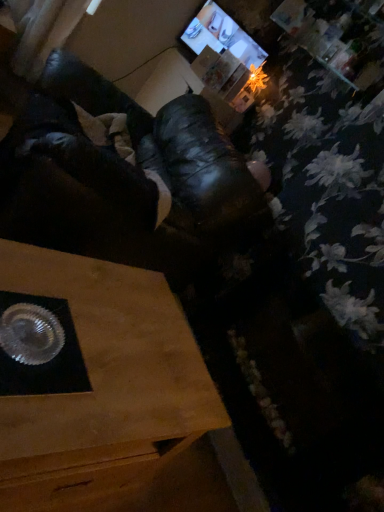
Question: Does wooden table at lower left lie in front of matte black monitor at upper center?

Choices:
 (A) no
 (B) yes

Answer: (B)

Question: Is wooden table at lower left completely or partially outside of matte black monitor at upper center?

Choices:
 (A) no
 (B) yes

Answer: (B)

Question: From a real-world perspective, is wooden table at lower left positioned under matte black monitor at upper center based on gravity?

Choices:
 (A) no
 (B) yes

Answer: (B)

Question: Is wooden table at lower left wider than matte black monitor at upper center?

Choices:
 (A) yes
 (B) no

Answer: (A)

Question: Does wooden table at lower left have a lesser width compared to matte black monitor at upper center?

Choices:
 (A) no
 (B) yes

Answer: (A)

Question: Is matte black monitor at upper center taller or shorter than shiny metallic tray at lower left?

Choices:
 (A) tall
 (B) short

Answer: (B)

Question: Visually, is matte black monitor at upper center positioned to the left or to the right of shiny metallic tray at lower left?

Choices:
 (A) right
 (B) left

Answer: (A)

Question: Based on their sizes in the image, would you say matte black monitor at upper center is bigger or smaller than shiny metallic tray at lower left?

Choices:
 (A) big
 (B) small

Answer: (B)

Question: In terms of width, does matte black monitor at upper center look wider or thinner when compared to shiny metallic tray at lower left?

Choices:
 (A) thin
 (B) wide

Answer: (A)

Question: In terms of height, does shiny metallic tray at lower left look taller or shorter compared to wooden table at lower left?

Choices:
 (A) tall
 (B) short

Answer: (A)

Question: Considering the positions of shiny metallic tray at lower left and wooden table at lower left in the image, is shiny metallic tray at lower left wider or thinner than wooden table at lower left?

Choices:
 (A) wide
 (B) thin

Answer: (A)

Question: From a real-world perspective, relative to wooden table at lower left, is shiny metallic tray at lower left vertically above or below?

Choices:
 (A) below
 (B) above

Answer: (B)

Question: Is shiny metallic tray at lower left in front of or behind wooden table at lower left in the image?

Choices:
 (A) behind
 (B) front

Answer: (A)

Question: Is point (253, 52) positioned closer to the camera than point (185, 437)?

Choices:
 (A) farther
 (B) closer

Answer: (A)

Question: Would you say matte black monitor at upper center is to the left or to the right of wooden table at lower left in the picture?

Choices:
 (A) left
 (B) right

Answer: (B)